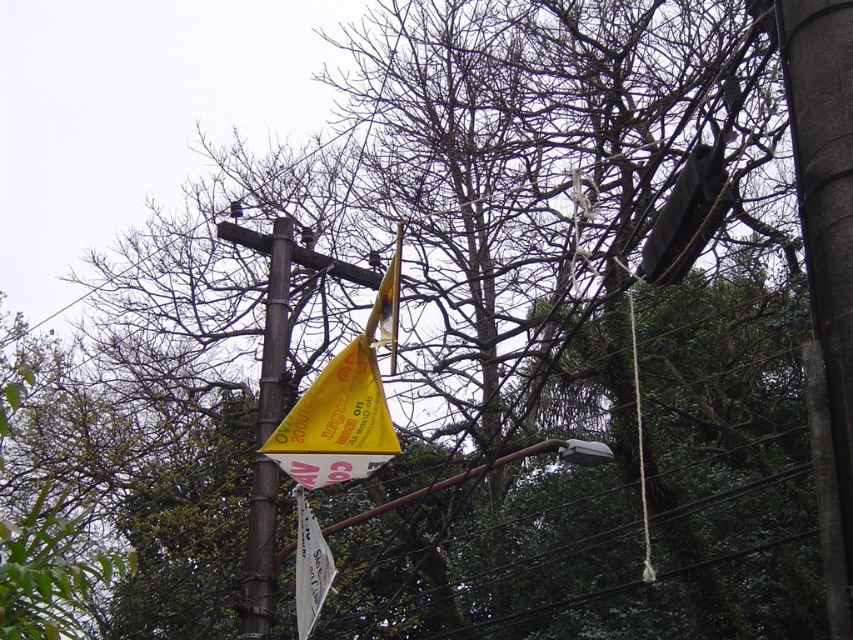
Question: Which of the following is the farthest from the observer?

Choices:
 (A) (280, 460)
 (B) (440, 484)
 (C) (276, 291)
 (D) (318, 566)

Answer: (C)

Question: Considering the real-world distances, which object is closest to the white paper sign at lower center?

Choices:
 (A) wooden telegraph pole at center
 (B) yellow paper sign at upper left

Answer: (B)

Question: Is yellow paper sign at upper left below white paper sign at lower center?

Choices:
 (A) no
 (B) yes

Answer: (A)

Question: Does white paper sign at lower center appear over metallic gray streetlight at upper center?

Choices:
 (A) yes
 (B) no

Answer: (B)

Question: In this image, where is yellow paper sign at upper left located relative to metallic gray streetlight at upper center?

Choices:
 (A) above
 (B) below

Answer: (A)

Question: Which is nearer to the wooden telegraph pole at center?

Choices:
 (A) rusty metal telegraph pole at center
 (B) metallic gray streetlight at upper center
 (C) white paper sign at lower center
 (D) yellow paper sign at upper left

Answer: (A)